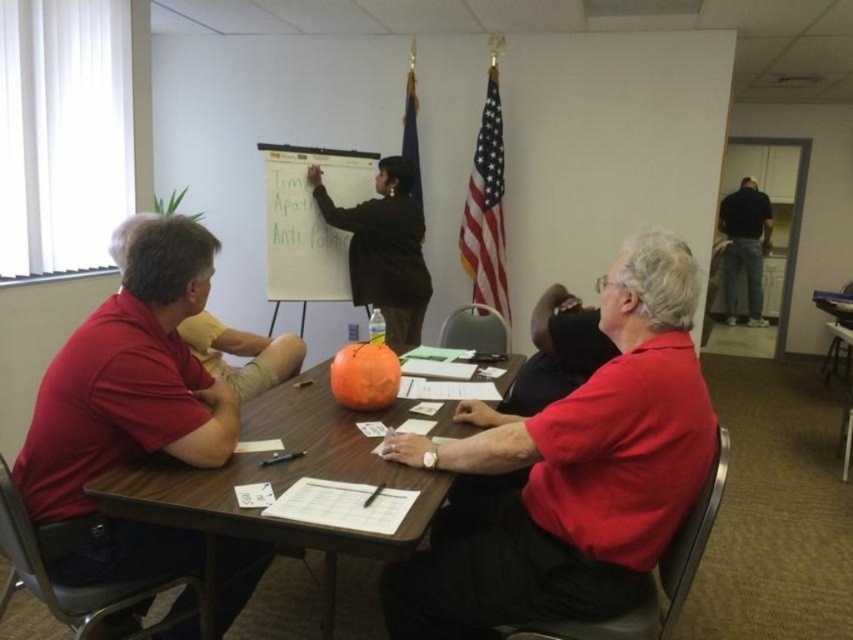
Who is more forward, (616,337) or (225,499)?

Positioned in front is point (225,499).

Between red matte shirt at center and wooden table at center, which one is positioned lower?

wooden table at center

Image resolution: width=853 pixels, height=640 pixels. Describe the element at coordinates (567, 474) in the screenshot. I see `red matte shirt at center` at that location.

Find the location of a particular element. Image resolution: width=853 pixels, height=640 pixels. red matte shirt at center is located at coordinates (567, 474).

Between red matte shirt at center and whiteboard at upper center, which one has less height?

whiteboard at upper center is shorter.

What do you see at coordinates (567, 474) in the screenshot?
I see `red matte shirt at center` at bounding box center [567, 474].

Locate an element on the screen. red matte shirt at center is located at coordinates (567, 474).

Does matte red shirt at left appear under black smooth shirt at upper right?

Yes.

How distant is matte red shirt at left from black smooth shirt at upper right?

7.52 meters

Find the location of a particular element. The image size is (853, 640). matte red shirt at left is located at coordinates tap(129, 380).

Find the location of a particular element. This screenshot has width=853, height=640. matte red shirt at left is located at coordinates (129, 380).